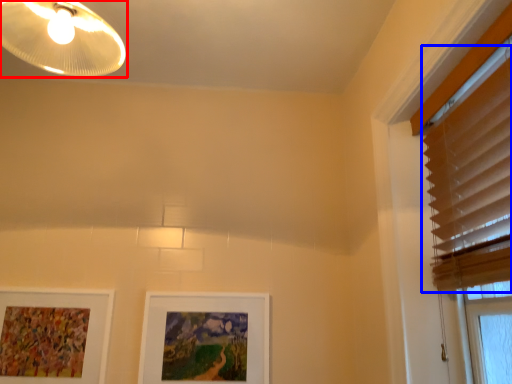
Question: Which point is closer to the camera, lamp (highlighted by a red box) or blind (highlighted by a blue box)?

Choices:
 (A) lamp
 (B) blind

Answer: (B)